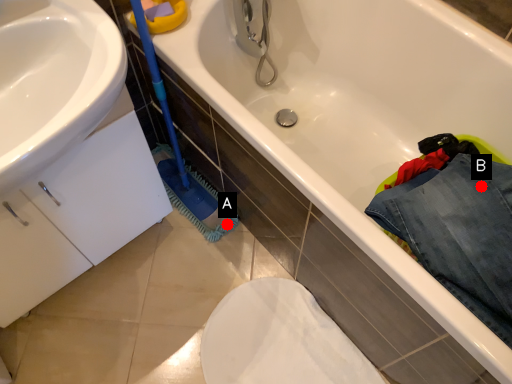
Question: Two points are circled on the image, labeled by A and B beside each circle. Which point is further to the camera?

Choices:
 (A) A is further
 (B) B is further

Answer: (A)